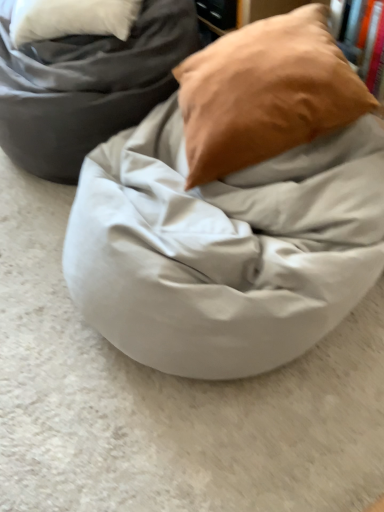
Locate an element on the screen. matte brown pillow at upper right is located at coordinates (265, 93).

You are a GUI agent. You are given a task and a screenshot of the screen. Output one action in this format:
    pyautogui.click(x=<x>, y=<y>)
    Task: Click on the matte gray bean bag at center
    
    Given the screenshot: What is the action you would take?
    pyautogui.click(x=87, y=86)

Where is `matte white bean bag at center`? This screenshot has width=384, height=512. matte white bean bag at center is located at coordinates (224, 247).

How many degrees apart are the facing directions of matte gray bean bag at center and matte white bean bag at center?

179 degrees.

From the image's perspective, which one is positioned lower, matte gray bean bag at center or matte white bean bag at center?

matte white bean bag at center appears lower in the image.

Locate an element on the screen. Image resolution: width=384 pixels, height=512 pixels. blanket on the right of matte gray bean bag at center is located at coordinates (224, 247).

Based on the photo, considering the relative sizes of matte gray bean bag at center and matte white bean bag at center in the image provided, is matte gray bean bag at center shorter than matte white bean bag at center?

Incorrect, the height of matte gray bean bag at center does not fall short of that of matte white bean bag at center.

From the image's perspective, would you say matte white bean bag at center is positioned over matte gray bean bag at center?

No, from the image's perspective, matte white bean bag at center is not on top of matte gray bean bag at center.

How many degrees apart are the facing directions of matte white bean bag at center and matte gray bean bag at center?

179 degrees.

Is matte white bean bag at center next to matte gray bean bag at center and touching it?

They are not placed beside each other.

Which of these two, matte white bean bag at center or matte brown pillow at upper right, is smaller?

Smaller between the two is matte brown pillow at upper right.

Is matte white bean bag at center not inside matte brown pillow at upper right?

That's correct, matte white bean bag at center is outside of matte brown pillow at upper right.

From a real-world perspective, which is physically above, matte white bean bag at center or matte brown pillow at upper right?

matte brown pillow at upper right is physically above.

Considering the positions of objects matte brown pillow at upper right and matte white bean bag at center in the image provided, who is more to the left, matte brown pillow at upper right or matte white bean bag at center?

From the viewer's perspective, matte white bean bag at center appears more on the left side.

From their relative heights in the image, would you say matte brown pillow at upper right is taller or shorter than matte white bean bag at center?

matte brown pillow at upper right is taller than matte white bean bag at center.

Is matte brown pillow at upper right oriented towards matte white bean bag at center?

No, matte brown pillow at upper right does not turn towards matte white bean bag at center.

In terms of height, does matte gray bean bag at center look taller or shorter compared to matte brown pillow at upper right?

Clearly, matte gray bean bag at center is taller compared to matte brown pillow at upper right.

Is matte gray bean bag at center at the left side of matte brown pillow at upper right?

Yes.

Considering the sizes of matte gray bean bag at center and matte brown pillow at upper right in the image, is matte gray bean bag at center bigger or smaller than matte brown pillow at upper right?

matte gray bean bag at center is bigger than matte brown pillow at upper right.

Is matte brown pillow at upper right positioned with its back to matte gray bean bag at center?

No, matte brown pillow at upper right is not facing the opposite direction of matte gray bean bag at center.

How different are the orientations of matte brown pillow at upper right and matte gray bean bag at center in degrees?

The angular difference between matte brown pillow at upper right and matte gray bean bag at center is 28.8 degrees.

Is matte gray bean bag at center located within matte brown pillow at upper right?

No, matte gray bean bag at center is not inside matte brown pillow at upper right.

Consider the image. Does matte brown pillow at upper right have a greater width compared to matte gray bean bag at center?

No, matte brown pillow at upper right is not wider than matte gray bean bag at center.

This screenshot has height=512, width=384. In the image, there is a matte white bean bag at center. Identify the location of furniture above it (from the image's perspective). (87, 86).

Find the location of a particular element. Image resolution: width=384 pixels, height=512 pixels. furniture located above the matte white bean bag at center (from a real-world perspective) is located at coordinates (87, 86).

Looking at the image, which one is located further to matte gray bean bag at center, matte white bean bag at center or matte brown pillow at upper right?

Among the two, matte white bean bag at center is located further to matte gray bean bag at center.

Estimate the real-world distances between objects in this image. Which object is closer to matte white bean bag at center, matte gray bean bag at center or matte brown pillow at upper right?

The object closer to matte white bean bag at center is matte brown pillow at upper right.

Based on their spatial positions, is matte brown pillow at upper right or matte white bean bag at center further from matte gray bean bag at center?

matte white bean bag at center lies further to matte gray bean bag at center than the other object.

Considering their positions, is matte brown pillow at upper right positioned further to matte white bean bag at center than matte gray bean bag at center?

The object further to matte white bean bag at center is matte gray bean bag at center.

Considering their positions, is matte gray bean bag at center positioned further to matte brown pillow at upper right than matte white bean bag at center?

The object further to matte brown pillow at upper right is matte gray bean bag at center.

From the image, which object appears to be farther from matte brown pillow at upper right, matte white bean bag at center or matte gray bean bag at center?

Among the two, matte gray bean bag at center is located further to matte brown pillow at upper right.

The height and width of the screenshot is (512, 384). Find the location of `pillow between matte gray bean bag at center and matte white bean bag at center from top to bottom`. pillow between matte gray bean bag at center and matte white bean bag at center from top to bottom is located at coordinates (265, 93).